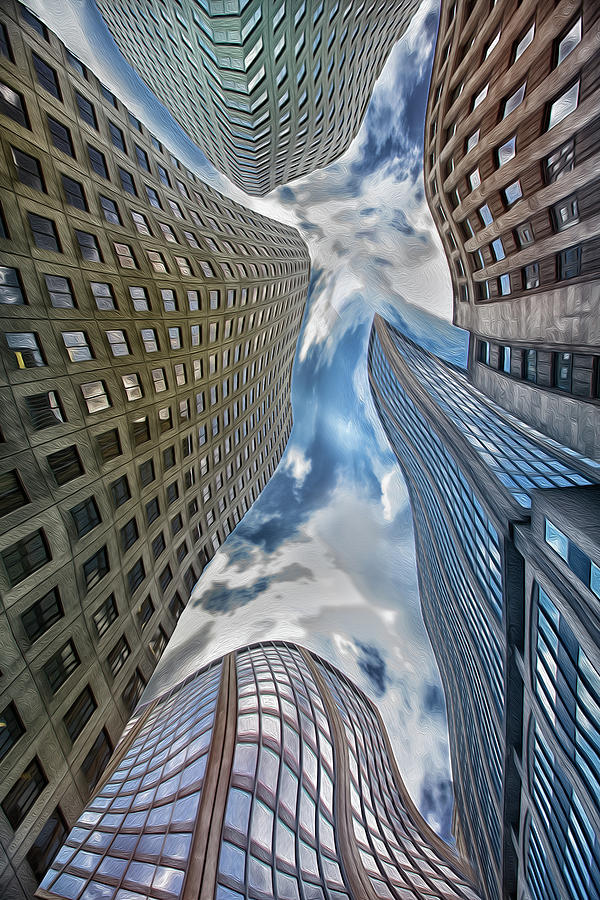
Locate an element on the screen. This screenshot has height=900, width=600. black row area between windows right side is located at coordinates (577, 568), (568, 644), (566, 680), (563, 714), (560, 745), (552, 770), (554, 794), (556, 802), (554, 841), (540, 894).